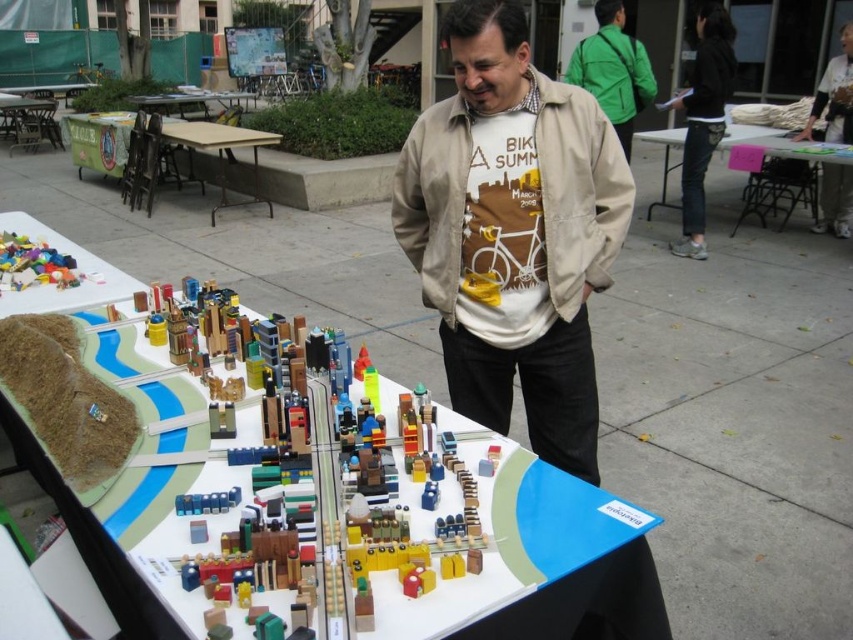
You are organizing a small outdoor event and need to decide whether to place a 15 cm wide decorative item on the pink paper at upper right or the white plastic table at upper left. Based on their sizes, which surface can accommodate the item?

The white plastic table at upper left has a greater width than the pink paper at upper right. Since the item is 15 cm wide, it can fit on the white plastic table at upper left, but may not fit on the pink paper at upper right due to its smaller width.

You are a photographer trying to capture a clear shot of the wooden table at center without the beige cotton jacket at center blocking it. Based on their positions, which side of the table should you move to in order to frame the table without the jacket?

The beige cotton jacket at center is positioned on the right side of wooden table at center, so you should move to the left side of the wooden table at center to frame it without the jacket blocking the view.

You are a guest at an event and see the pink paper at upper right and the white plastic table at upper left. Which object is located to the right side of the other?

The pink paper at upper right is to the right of the white plastic table at upper left.